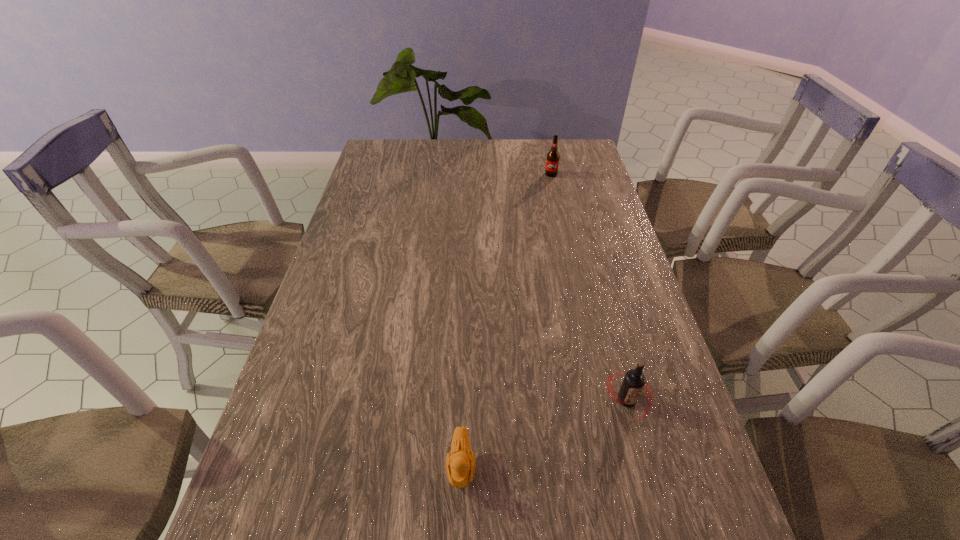
Locate an element on the screen. This screenshot has width=960, height=540. the farther root beer is located at coordinates (552, 162).

Locate an element on the screen. the second nearest object is located at coordinates (634, 382).

You are a GUI agent. You are given a task and a screenshot of the screen. Output one action in this format:
    pyautogui.click(x=<x>, y=<y>)
    Task: Click on the leftmost object
    This screenshot has width=960, height=540.
    Given the screenshot: What is the action you would take?
    pyautogui.click(x=460, y=464)

At what (x,y) coordinates should I click in order to perform the action: click on duckling. Please return your answer as a coordinate pair (x, y). This screenshot has width=960, height=540. Looking at the image, I should click on (460, 464).

Locate an element on the screen. Image resolution: width=960 pixels, height=540 pixels. vacant space located on the back of the farther root beer is located at coordinates (548, 161).

The width and height of the screenshot is (960, 540). Identify the location of vacant region located on the label of the nearer root beer. (651, 489).

Find the location of a particular element. This screenshot has width=960, height=540. blank space located on the face of the shortest object is located at coordinates (460, 525).

What are the coordinates of `free space at the far edge` in the screenshot? It's located at [502, 160].

Where is `vacant space at the left edge of the desktop`? This screenshot has width=960, height=540. vacant space at the left edge of the desktop is located at coordinates (367, 259).

At what (x,y) coordinates should I click in order to perform the action: click on vacant space at the right edge of the desktop. Please return your answer as a coordinate pair (x, y). The width and height of the screenshot is (960, 540). Looking at the image, I should click on (602, 239).